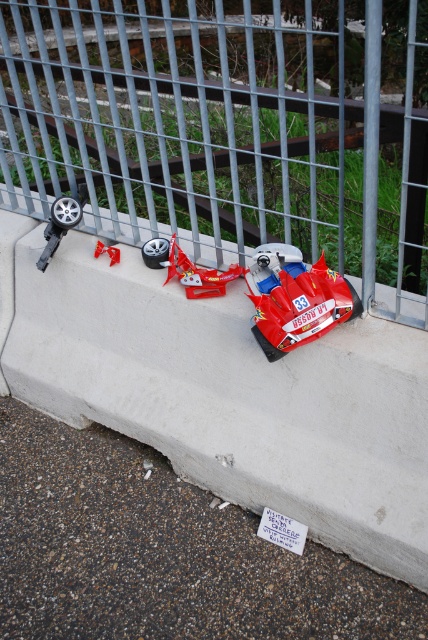
You are a child who wants to place the shiny red plastic toy car at lower right on top of the gray asphalt at lower center. Can you do this without the car falling off?

The gray asphalt at lower center is taller than the shiny red plastic toy car at lower right, so placing the car on top would be possible as the asphalt provides a stable base. However, since the car is damaged and missing parts, it might not stay balanced and could fall off.

You are a delivery drone that needs to fly from the metallic gray fence at upper center to the shiny red car at center. What is the minimum distance you must fly to reach the car?

The metallic gray fence at upper center and shiny red car at center are 4.27 feet apart, so the minimum distance you must fly is 4.27 feet.